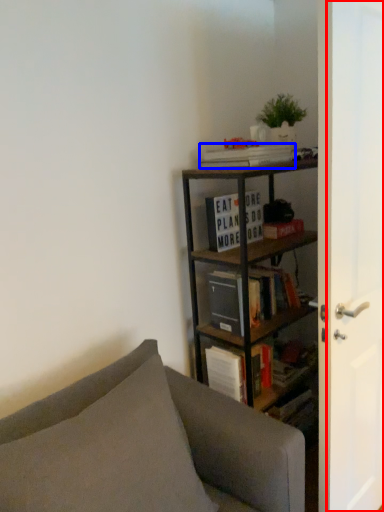
Question: Which object appears farthest to the camera in this image, screen door (highlighted by a red box) or book (highlighted by a blue box)?

Choices:
 (A) screen door
 (B) book

Answer: (B)